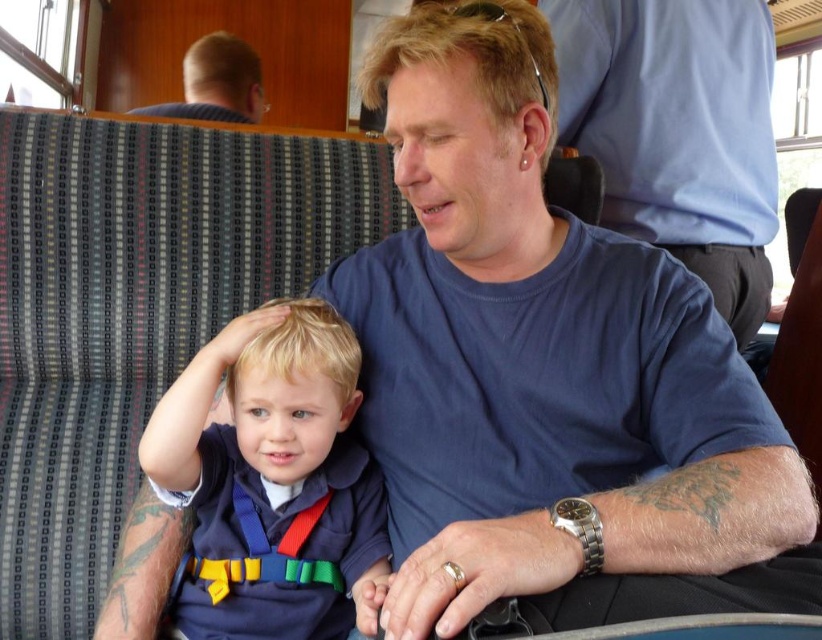
You are a passenger on a train and want to know if the blue fabric shirt at center is thicker than the blonde hair at upper left. Based on the scene, what can you conclude?

The blue fabric shirt at center is thinner than the blonde hair at upper left, so it is not thicker.

You are a photographer trying to capture a candid shot of the blue cotton shirt at upper center and the blonde hair at upper left. Since you want both subjects to be in focus, which one should you adjust your camera focus on first to ensure proper framing?

The blue cotton shirt at upper center is taller than the blonde hair at upper left, so you should focus on the blue cotton shirt at upper center first to ensure both are in frame.